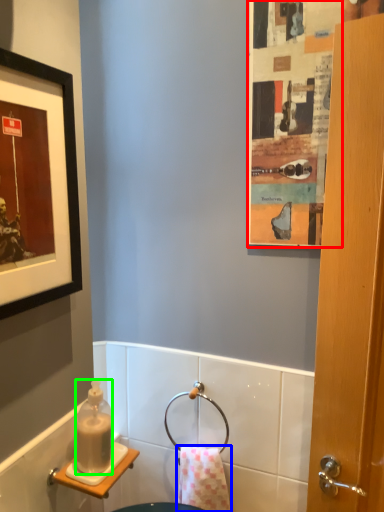
Question: Which object is positioned closest to poster (highlighted by a red box)? Select from towel/napkin (highlighted by a blue box) and bottle (highlighted by a green box).

Choices:
 (A) towel/napkin
 (B) bottle

Answer: (B)